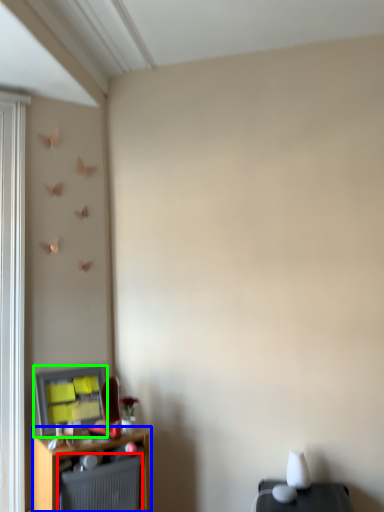
Question: Which is farther away from radiator (highlighted by a red box)? shelf (highlighted by a blue box) or window screen (highlighted by a green box)?

Choices:
 (A) shelf
 (B) window screen

Answer: (B)